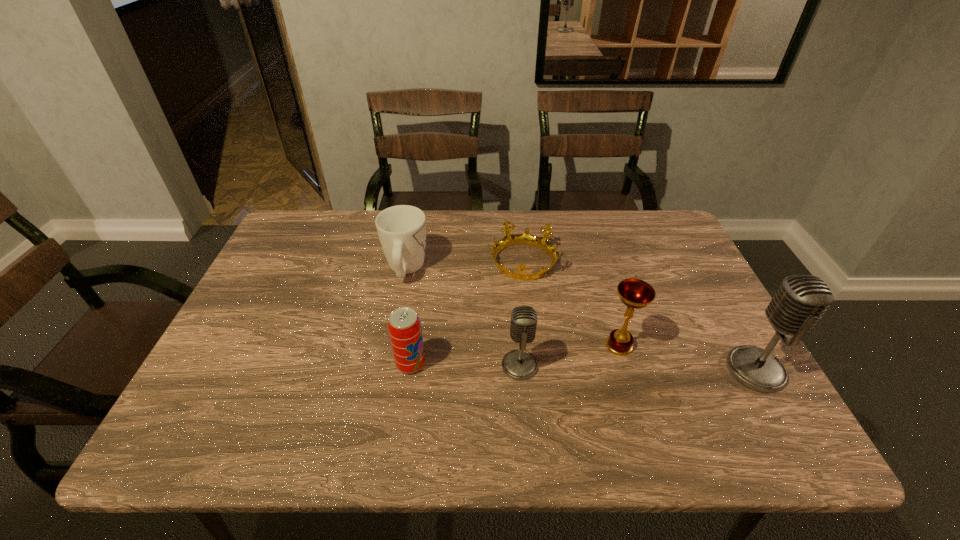
Locate an element on the screen. This screenshot has width=960, height=540. free spot between the crown and the chalice is located at coordinates (571, 304).

This screenshot has height=540, width=960. What are the coordinates of `free space between the right microphone and the chalice` in the screenshot? It's located at (687, 358).

This screenshot has width=960, height=540. I want to click on free space between the mug and the rightmost object, so click(581, 320).

Where is `vacant area that lies between the right microphone and the shorter microphone`? vacant area that lies between the right microphone and the shorter microphone is located at coordinates (637, 368).

I want to click on free point between the left microphone and the mug, so click(x=463, y=318).

The width and height of the screenshot is (960, 540). What are the coordinates of `object that ranks as the fourth closest to the fifth object from left to right` in the screenshot? It's located at (404, 326).

This screenshot has height=540, width=960. What are the coordinates of `the third closest object relative to the shortest object` in the screenshot? It's located at (519, 364).

Locate an element on the screen. vacant area in the image that satisfies the following two spatial constraints: 1. on the front side of the crown; 2. on the left side of the rightmost object is located at coordinates (535, 370).

Find the location of a particular element. The height and width of the screenshot is (540, 960). vacant area that satisfies the following two spatial constraints: 1. on the side of the mug with the handle; 2. on the left side of the shortest object is located at coordinates (407, 262).

You are a GUI agent. You are given a task and a screenshot of the screen. Output one action in this format:
    pyautogui.click(x=<x>, y=<y>)
    Task: Click on the vacant space that satisfies the following two spatial constraints: 1. on the front side of the fifth object from left to right; 2. on the right side of the rightmost object
    Image resolution: width=960 pixels, height=540 pixels.
    Given the screenshot: What is the action you would take?
    pyautogui.click(x=627, y=370)